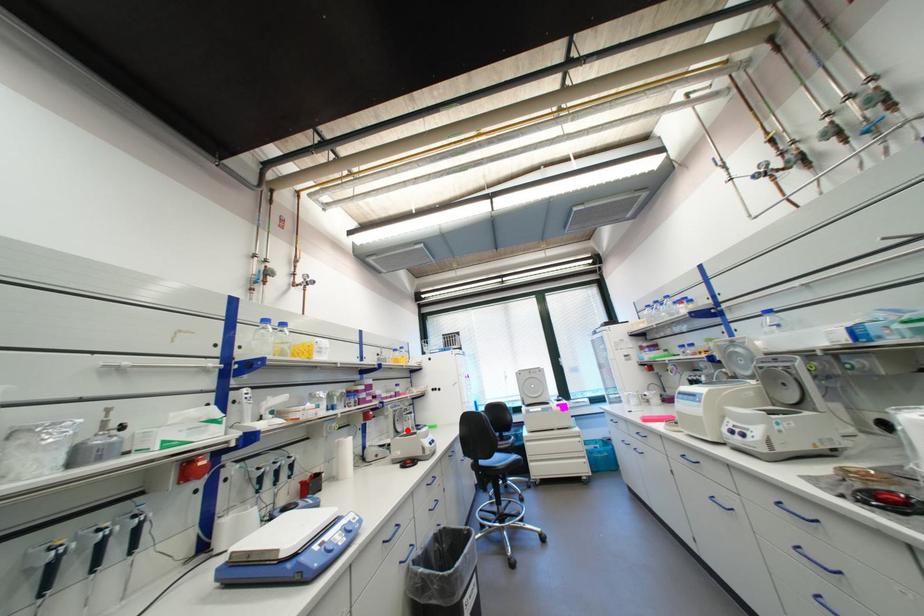
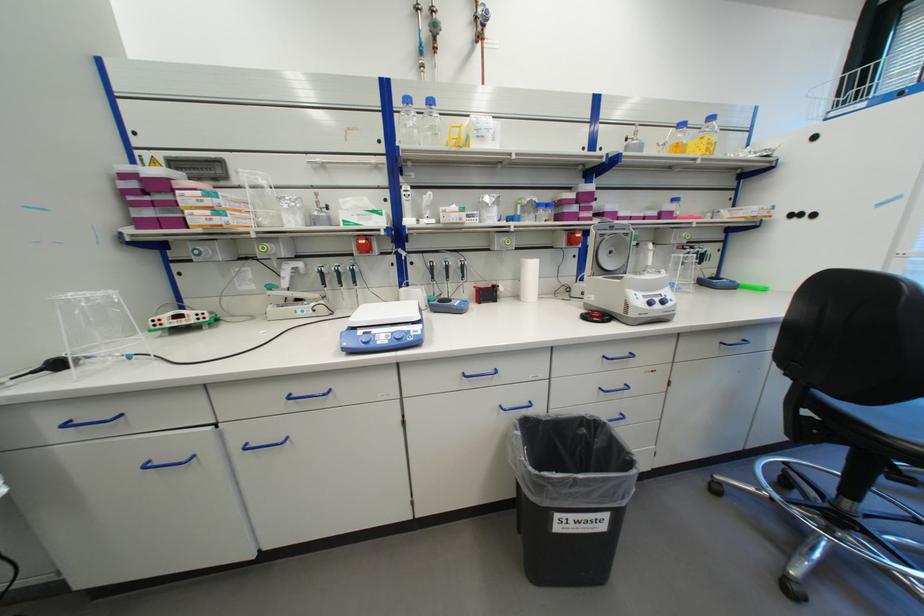
Question: I am providing you with two images of the same scene from different viewpoints. In image1, a red point is highlighted. Considering the same 3D point in image2, which of the following is correct?

Choices:
 (A) It is closer
 (B) It is farther

Answer: (A)